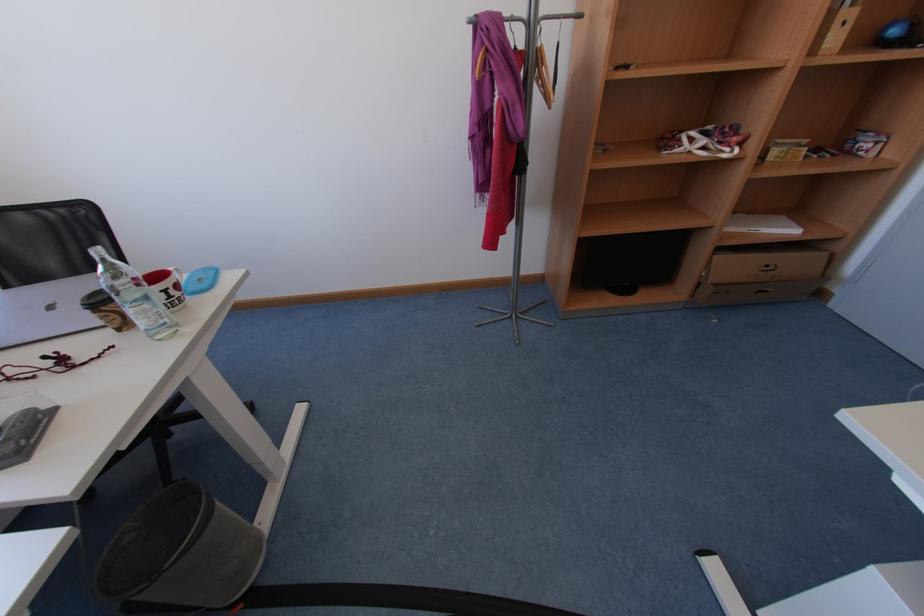
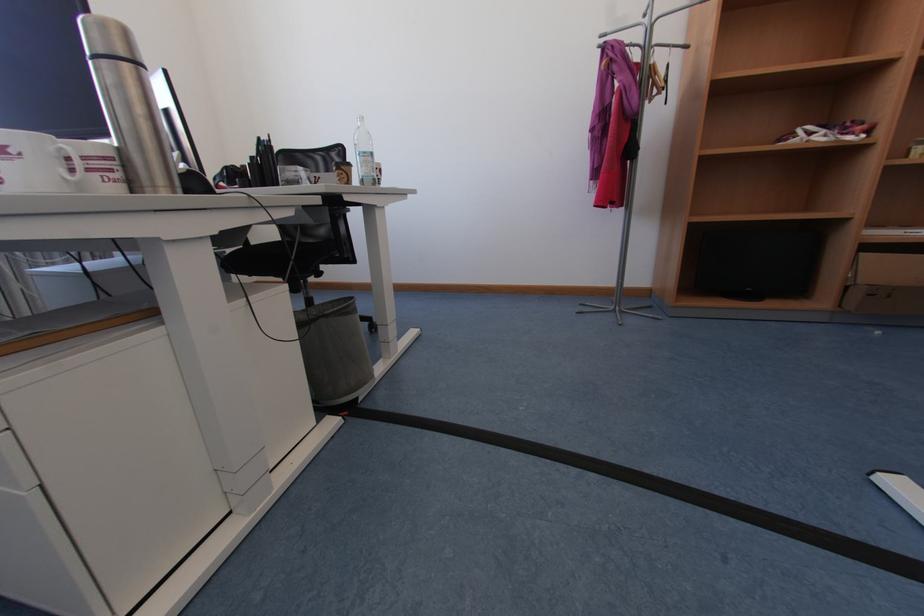
Question: The images are taken continuously from a first-person perspective. In which direction are you moving?

Choices:
 (A) Left
 (B) Right
 (C) Forward
 (D) Backward

Answer: (D)